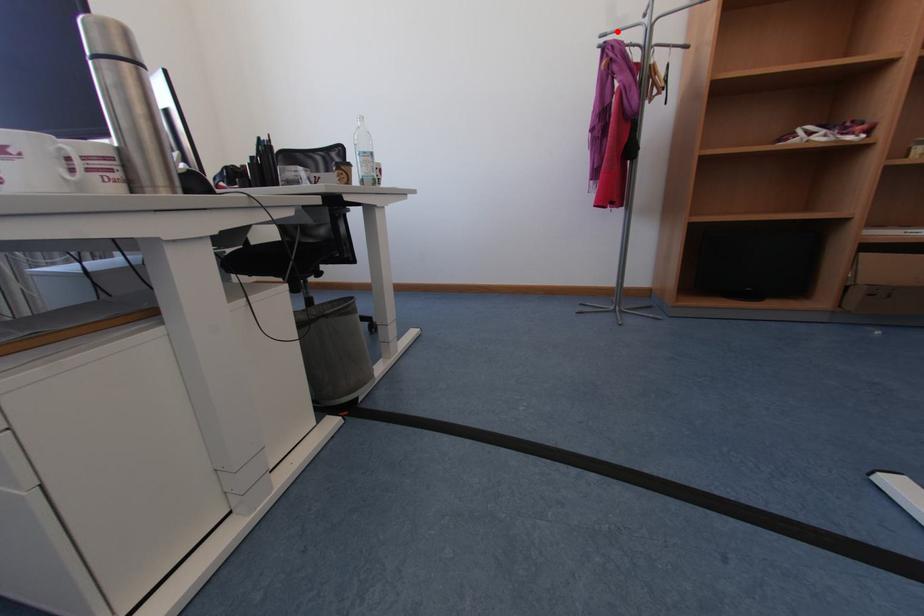
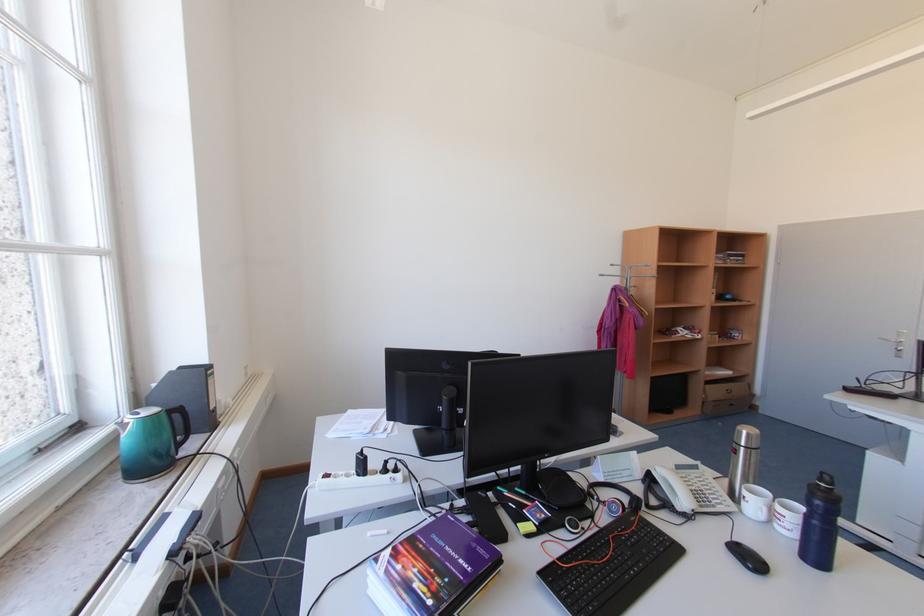
Find the pixel in the second image that matches the highlighted location in the first image.

(613, 275)